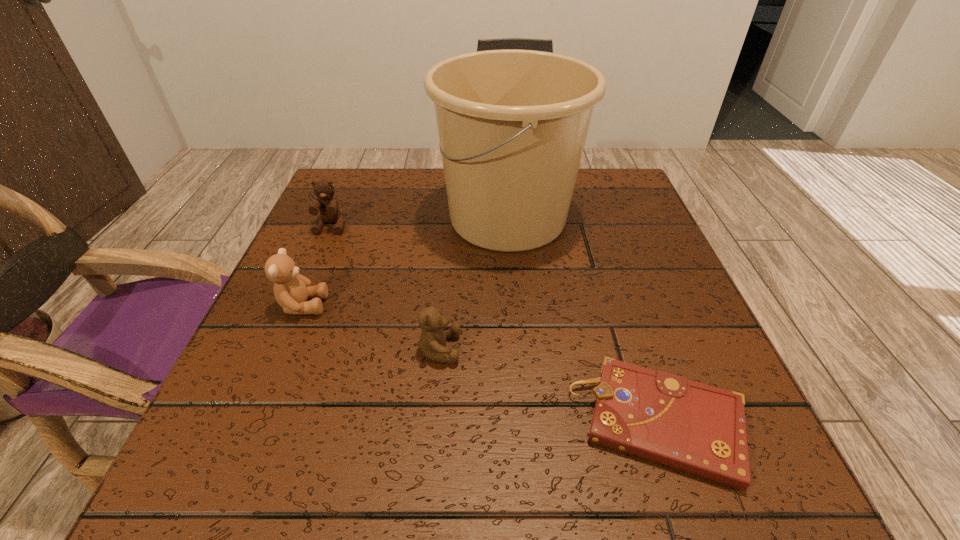
Where is `bucket located at the far edge`? The height and width of the screenshot is (540, 960). bucket located at the far edge is located at coordinates click(x=512, y=124).

Where is `teddy bear positioned at the far edge`? This screenshot has width=960, height=540. teddy bear positioned at the far edge is located at coordinates (329, 212).

Where is `object positioned at the near edge`? object positioned at the near edge is located at coordinates (697, 428).

What are the coordinates of `bucket at the right edge` in the screenshot? It's located at (512, 124).

Find the location of a particular element. This screenshot has height=540, width=960. notebook located at the right edge is located at coordinates (697, 428).

This screenshot has width=960, height=540. Find the location of `object that is at the far left corner`. object that is at the far left corner is located at coordinates (329, 212).

Identify the location of object present at the far right corner. This screenshot has height=540, width=960. (512, 124).

Find the location of a particular element. The image size is (960, 540). object that is positioned at the near right corner is located at coordinates 697,428.

You are a GUI agent. You are given a task and a screenshot of the screen. Output one action in this format:
    pyautogui.click(x=<x>, y=<y>)
    Task: Click on the vacant region at the far edge
    The image size is (960, 540).
    Given the screenshot: What is the action you would take?
    pyautogui.click(x=427, y=202)

This screenshot has height=540, width=960. In the image, there is a desktop. What are the coordinates of `vacant region at the near edge` in the screenshot? It's located at (442, 443).